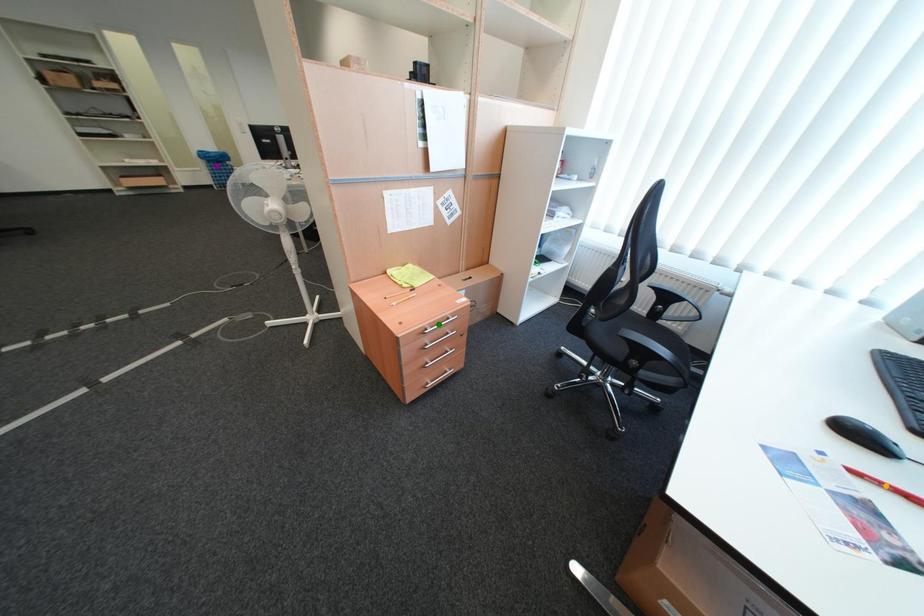
Order these from farthest to nearest:
green point, orange point, purple point

purple point, green point, orange point